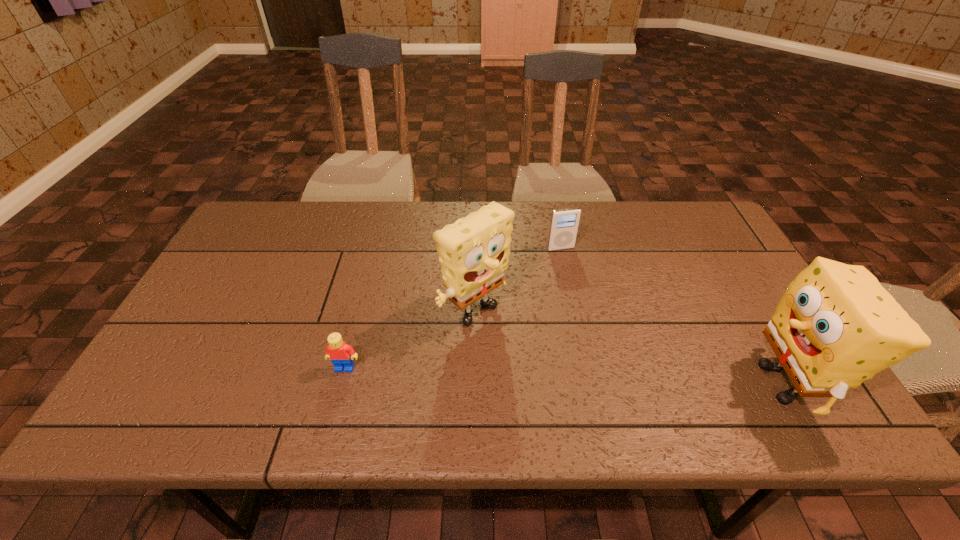
Find the location of `free space located 0.160m on the face of the left sponge`. free space located 0.160m on the face of the left sponge is located at coordinates (549, 384).

This screenshot has width=960, height=540. I want to click on vacant position located on the face of the left sponge, so click(x=552, y=387).

Find the location of a particular element. This screenshot has height=540, width=960. vacant area situated on the front-facing side of the iPod is located at coordinates (570, 265).

The height and width of the screenshot is (540, 960). Identify the location of vacant space located on the front-facing side of the iPod. (595, 313).

The width and height of the screenshot is (960, 540). I want to click on vacant space located on the front-facing side of the iPod, so click(x=609, y=341).

You are a GUI agent. You are given a task and a screenshot of the screen. Output one action in this format:
    pyautogui.click(x=<x>, y=<y>)
    Task: Click on the object at the far edge
    The image size is (960, 540).
    Given the screenshot: What is the action you would take?
    pyautogui.click(x=564, y=223)

This screenshot has width=960, height=540. I want to click on Lego located at the near edge, so click(x=341, y=354).

Where is `sponge at the near edge`? This screenshot has width=960, height=540. sponge at the near edge is located at coordinates 836,326.

Find the location of a particular element. object that is at the right edge is located at coordinates (836, 326).

Find the location of `object present at the near right corner`. object present at the near right corner is located at coordinates (836, 326).